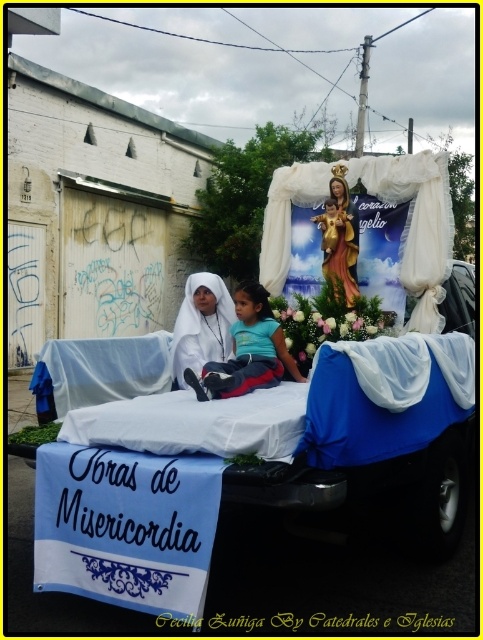
Is blue cotton shirt at center positioned at the back of white glossy statue at center?

No, it is not.

Which is more to the left, blue cotton shirt at center or white glossy statue at center?

Positioned to the left is blue cotton shirt at center.

The width and height of the screenshot is (483, 640). What do you see at coordinates (251, 348) in the screenshot? I see `blue cotton shirt at center` at bounding box center [251, 348].

This screenshot has height=640, width=483. What are the coordinates of `blue cotton shirt at center` in the screenshot? It's located at (251, 348).

Between point (202, 294) and point (349, 259), which one is positioned in front?

Point (202, 294) is more forward.

Where is `white cloth at center`? This screenshot has height=640, width=483. white cloth at center is located at coordinates (201, 324).

Between point (178, 387) and point (351, 294), which one is positioned behind?

The point (351, 294) is more distant.

Where is `white cloth at center`? This screenshot has width=483, height=640. white cloth at center is located at coordinates (201, 324).

Who is lower down, blue cotton shirt at center or white cloth at center?

Positioned lower is blue cotton shirt at center.

Is blue cotton shirt at center to the right of white cloth at center from the viewer's perspective?

Yes, blue cotton shirt at center is to the right of white cloth at center.

Between point (253, 384) and point (190, 291), which one is positioned behind?

Positioned behind is point (190, 291).

Locate an element on the screen. blue cotton shirt at center is located at coordinates (251, 348).